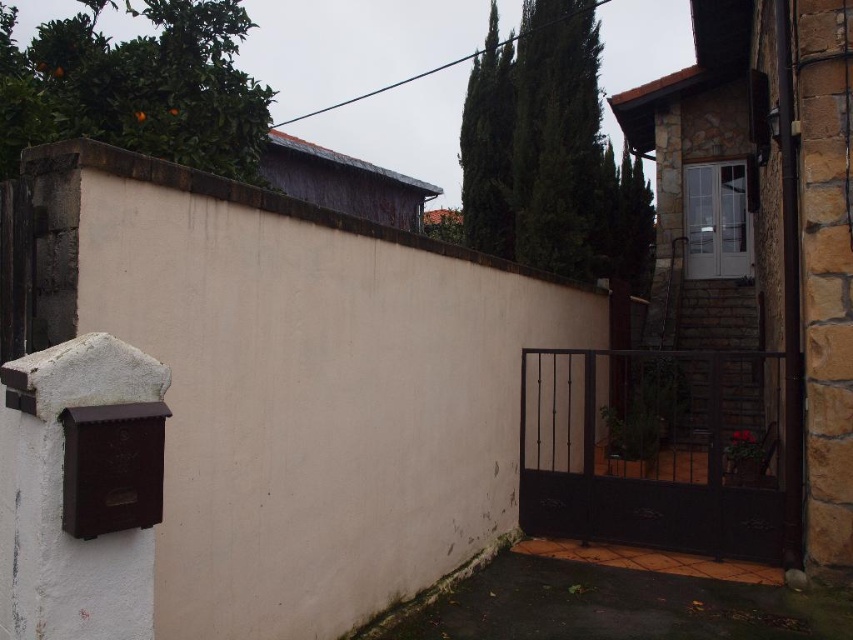
You are a gardener assessing the trees in the residential area. You see the green leafy cypress tree at upper center and the green leafy cypress at upper left. Which tree should you prune first if you need to address the taller one first?

You should prune the green leafy cypress at upper left first because it is taller than the green leafy cypress tree at upper center.

You are a gardener who needs to trim the green leafy cypress tree at upper center and the green leafy cypress at upper left. Which tree requires more trimming because it is taller?

The green leafy cypress at upper left requires more trimming because it is taller than the green leafy cypress tree at upper center.